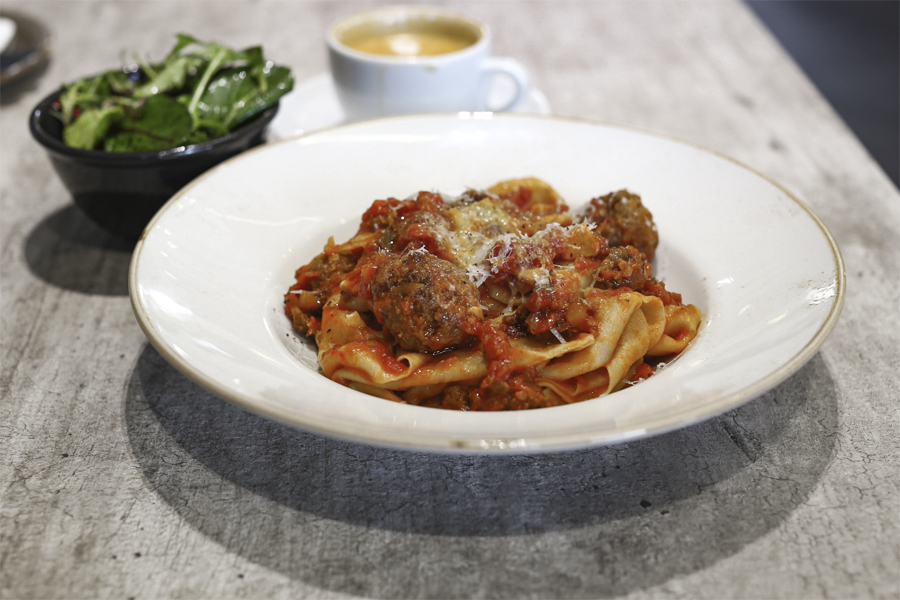
You are a GUI agent. You are given a task and a screenshot of the screen. Output one action in this format:
    pyautogui.click(x=<x>, y=<y>)
    Task: Click on the saucer
    
    Given the screenshot: What is the action you would take?
    pyautogui.click(x=304, y=109)